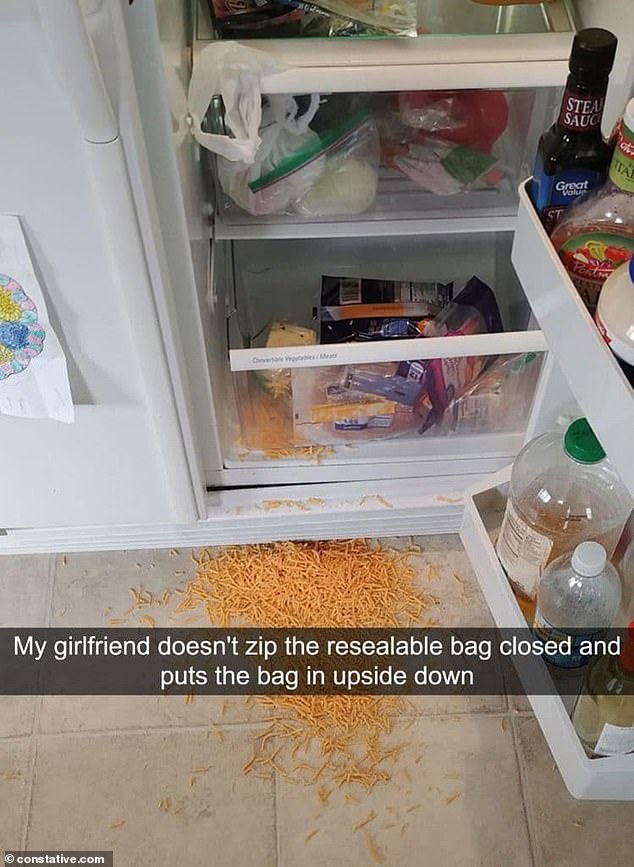
The width and height of the screenshot is (634, 867). I want to click on white refrigerator handle, so click(552, 70), click(66, 66).